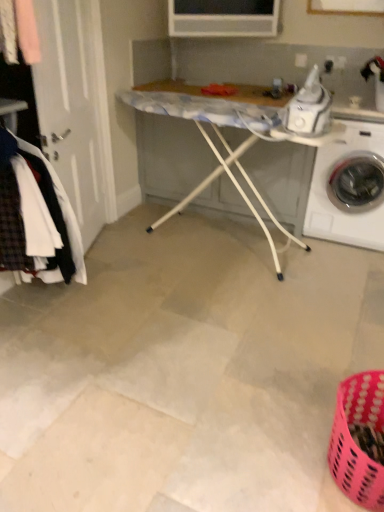
The width and height of the screenshot is (384, 512). I want to click on vacant space in white plastic ironing board at center (from a real-world perspective), so click(x=215, y=237).